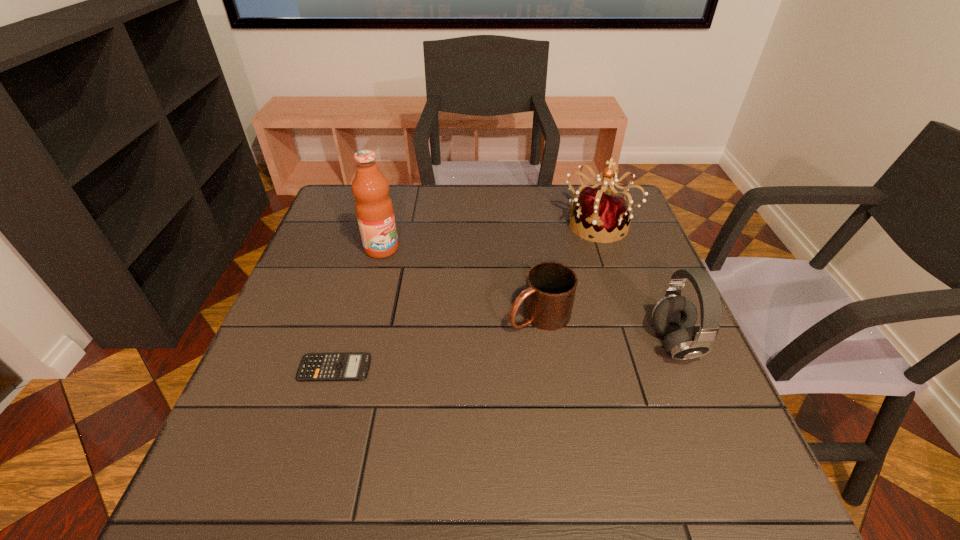
This screenshot has width=960, height=540. In order to click on calculator located in the left edge section of the desktop in this screenshot , I will do `click(314, 366)`.

I want to click on fruit juice present at the left edge, so click(374, 209).

Identify the location of headset present at the right edge. This screenshot has height=540, width=960. (674, 316).

Locate an element on the screen. This screenshot has width=960, height=540. tiara located at the right edge is located at coordinates 600,210.

Locate an element on the screen. This screenshot has height=540, width=960. object positioned at the far right corner is located at coordinates (600, 210).

What are the coordinates of `free location at the far edge of the desktop` in the screenshot? It's located at (414, 205).

The width and height of the screenshot is (960, 540). In the image, there is a desktop. What are the coordinates of `free space at the near edge` in the screenshot? It's located at (382, 410).

The width and height of the screenshot is (960, 540). I want to click on vacant space at the left edge, so click(342, 238).

In the image, there is a desktop. At what (x,y) coordinates should I click in order to perform the action: click on vacant space at the right edge. Please return your answer as a coordinate pair (x, y). This screenshot has height=540, width=960. Looking at the image, I should click on coord(642,266).

At what (x,y) coordinates should I click in order to perform the action: click on free space between the tiara and the shortest object. Please return your answer as a coordinate pair (x, y). Image resolution: width=960 pixels, height=540 pixels. Looking at the image, I should click on (466, 296).